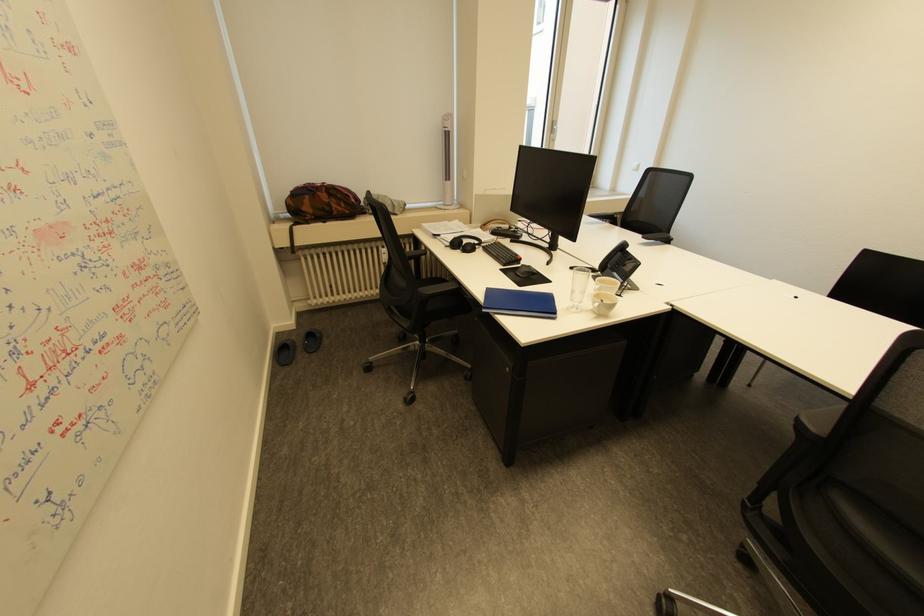
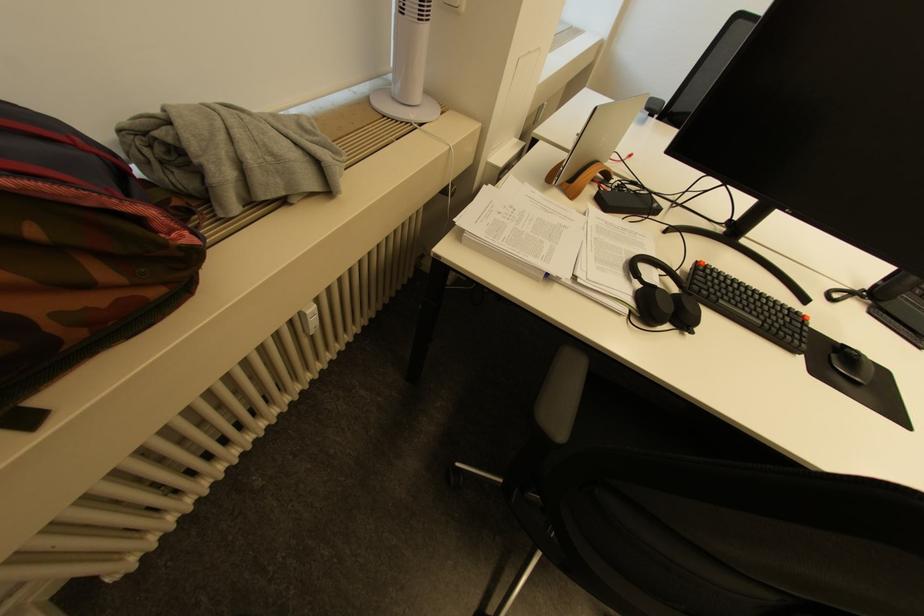
Find the pixel in the second image that matches point 359,200 in the first image.

(196, 238)